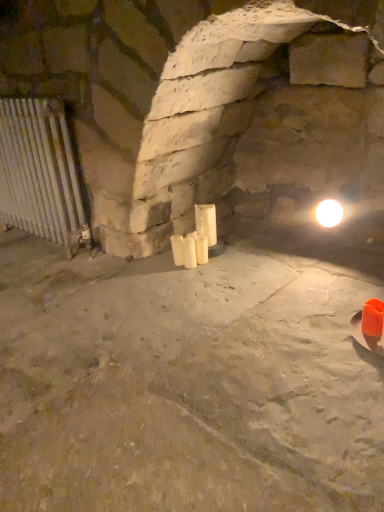
Question: Is white matte candle at center, which ranks as the first candle in right-to-left order, taller than silver metallic radiator at left?

Choices:
 (A) no
 (B) yes

Answer: (A)

Question: Is white matte candle at center, which is counted as the 3th candle, starting from the left, positioned beyond the bounds of silver metallic radiator at left?

Choices:
 (A) no
 (B) yes

Answer: (B)

Question: Does white matte candle at center, which is counted as the 3th candle, starting from the left, have a lesser height compared to silver metallic radiator at left?

Choices:
 (A) yes
 (B) no

Answer: (A)

Question: From the image's perspective, is white matte candle at center, which is counted as the 3th candle, starting from the left, located beneath silver metallic radiator at left?

Choices:
 (A) no
 (B) yes

Answer: (B)

Question: Does white matte candle at center, which is counted as the 3th candle, starting from the left, come in front of silver metallic radiator at left?

Choices:
 (A) yes
 (B) no

Answer: (B)

Question: Is white matte candle at center, which ranks as the first candle in right-to-left order, bigger than silver metallic radiator at left?

Choices:
 (A) no
 (B) yes

Answer: (A)

Question: Is white matte candle at center, which is counted as the 3th candle, starting from the left, oriented away from white matte candle at center, which is the second candle from right to left?

Choices:
 (A) yes
 (B) no

Answer: (B)

Question: Are white matte candle at center, which is counted as the 3th candle, starting from the left, and white matte candle at center, the second candle positioned from the left, far apart?

Choices:
 (A) yes
 (B) no

Answer: (B)

Question: Is white matte candle at center, which ranks as the first candle in right-to-left order, taller than white matte candle at center, the second candle positioned from the left?

Choices:
 (A) yes
 (B) no

Answer: (A)

Question: Does white matte candle at center, which is counted as the 3th candle, starting from the left, appear on the left side of white matte candle at center, the second candle positioned from the left?

Choices:
 (A) no
 (B) yes

Answer: (A)

Question: Would you say white matte candle at center, which ranks as the first candle in right-to-left order, is outside white matte candle at center, which is the second candle from right to left?

Choices:
 (A) yes
 (B) no

Answer: (A)

Question: Does white matte candle at center, which ranks as the first candle in right-to-left order, appear on the right side of white matte candle at center, which is the second candle from right to left?

Choices:
 (A) no
 (B) yes

Answer: (B)

Question: Considering the relative sizes of silver metallic radiator at left and white matte candle at center, which ranks as the 3th candle in right-to-left order, in the image provided, is silver metallic radiator at left thinner than white matte candle at center, which ranks as the 3th candle in right-to-left order,?

Choices:
 (A) yes
 (B) no

Answer: (B)